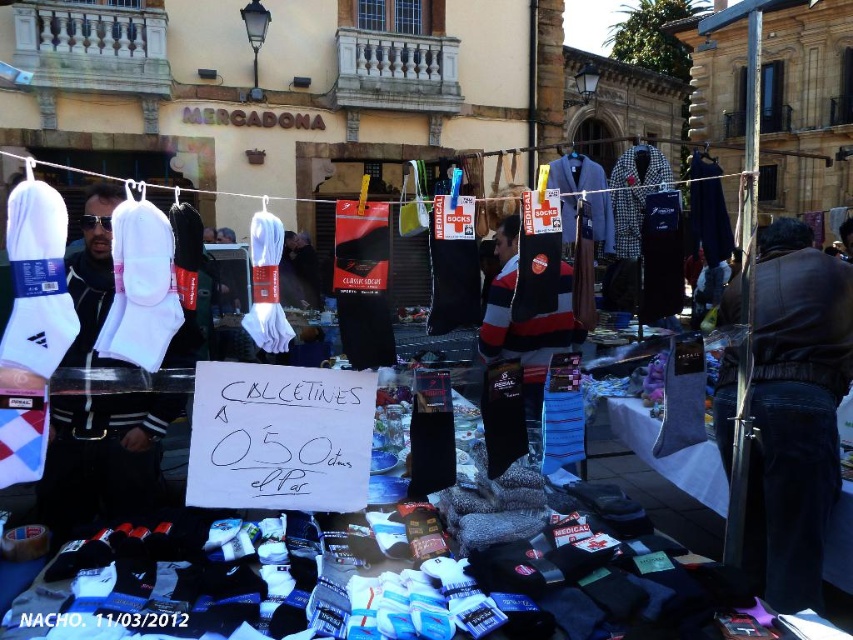
Who is shorter, dark brown leather jacket at right or white matte socks at left?

white matte socks at left is shorter.

Which is behind, point (811, 416) or point (103, 266)?

Positioned behind is point (103, 266).

Where is `dark brown leather jacket at right`? The width and height of the screenshot is (853, 640). dark brown leather jacket at right is located at coordinates (793, 412).